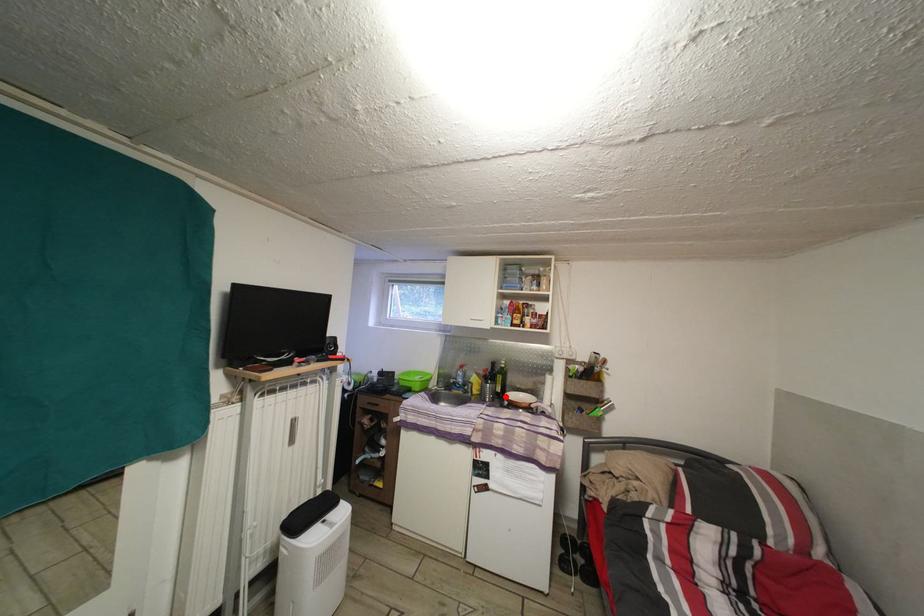
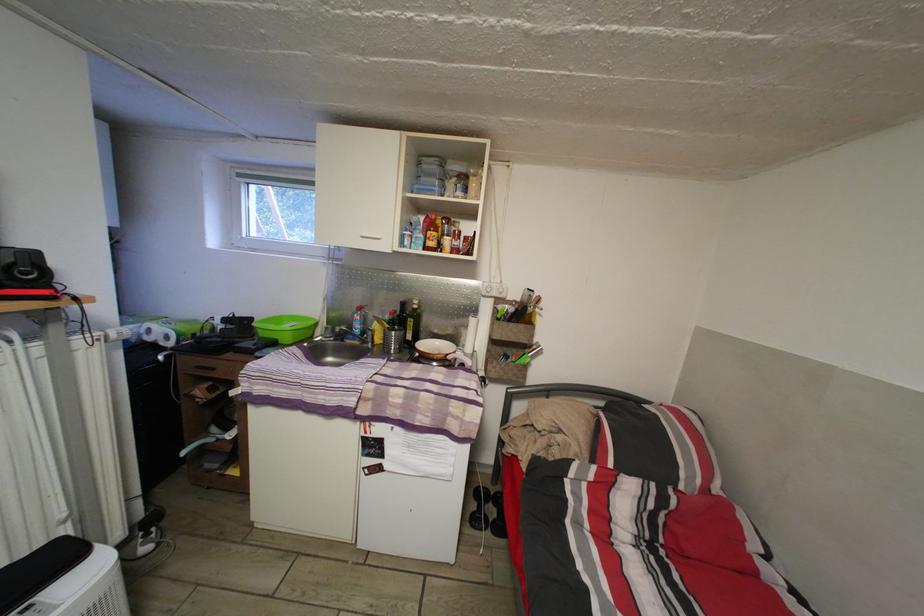
The point at the highlighted location is marked in the first image. Where is the corresponding point in the second image?

(417, 344)